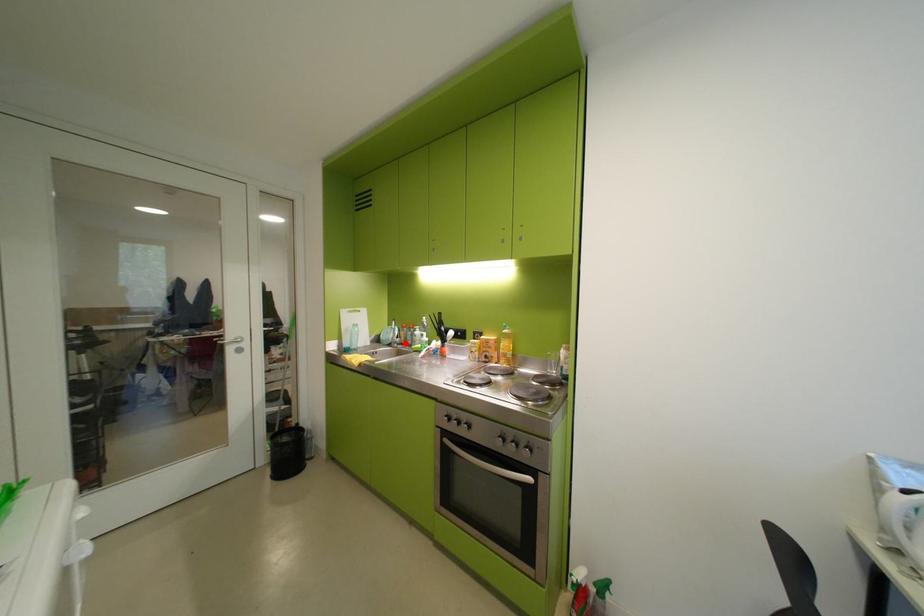
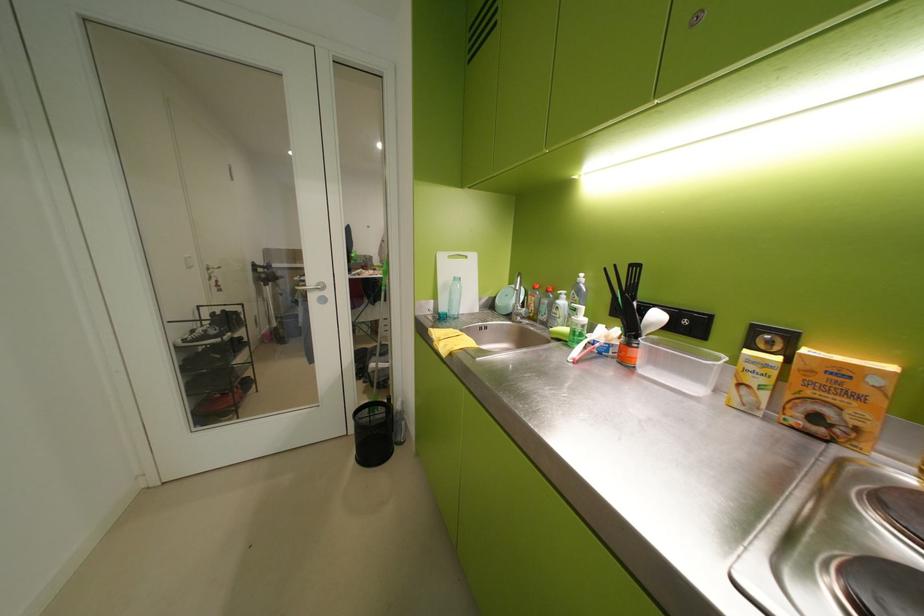
Question: I am providing you with two images of the same scene from different viewpoints. In image1, a red point is highlighted. Considering the same 3D point in image2, which of the following is correct?

Choices:
 (A) It is closer
 (B) It is farther

Answer: (A)